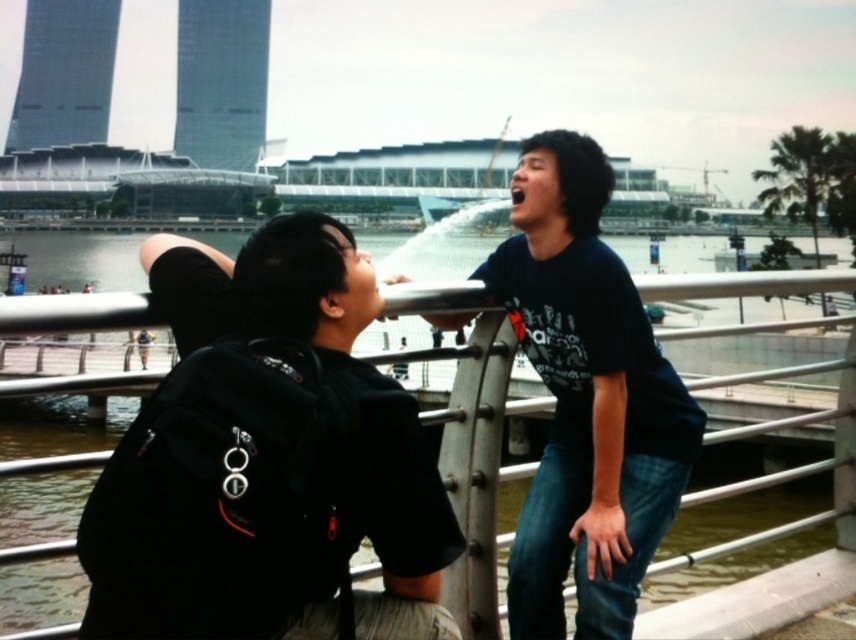
Is black matte backpack at center thinner than black cotton t-shirt at center?

Yes.

Image resolution: width=856 pixels, height=640 pixels. What are the coordinates of `black matte backpack at center` in the screenshot? It's located at (266, 460).

The height and width of the screenshot is (640, 856). I want to click on black matte backpack at center, so [x=266, y=460].

Is point (538, 205) in front of point (749, 484)?

Yes, point (538, 205) is closer to viewer.

Who is lower down, black cotton t-shirt at center or metallic gray rail at center?

Positioned lower is metallic gray rail at center.

Is point (670, 436) more distant than point (484, 529)?

Yes, point (670, 436) is behind point (484, 529).

Identify the location of black cotton t-shirt at center. Image resolution: width=856 pixels, height=640 pixels. (586, 401).

Does black matte backpack at center come in front of metallic gray rail at center?

No, black matte backpack at center is further to the viewer.

From the picture: Can you confirm if black matte backpack at center is wider than metallic gray rail at center?

No.

Does point (210, 580) come in front of point (486, 413)?

Yes.

Locate an element on the screen. Image resolution: width=856 pixels, height=640 pixels. black matte backpack at center is located at coordinates (266, 460).